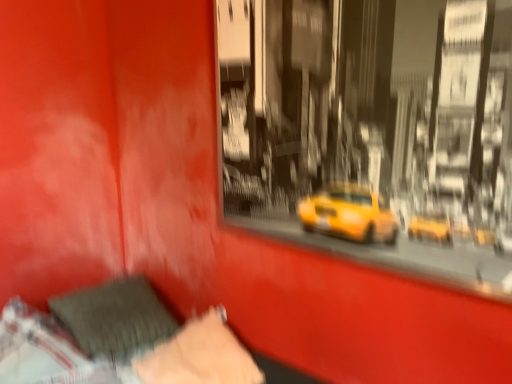
Question: Considering the positions of velvety black pillow at lower left, marked as the 2th pillow in a left-to-right arrangement, and velvety gray pillow at lower left, the second pillow in the right-to-left sequence, in the image, is velvety black pillow at lower left, marked as the 2th pillow in a left-to-right arrangement, bigger or smaller than velvety gray pillow at lower left, the second pillow in the right-to-left sequence,?

Choices:
 (A) small
 (B) big

Answer: (A)

Question: Is point (174, 347) positioned closer to the camera than point (173, 331)?

Choices:
 (A) farther
 (B) closer

Answer: (B)

Question: Which object is positioned farthest from the velvet-like gray pillow at lower left?

Choices:
 (A) velvety gray pillow at lower left, positioned as the first pillow in left-to-right order
 (B) velvety black pillow at lower left, positioned as the first pillow in right-to-left order

Answer: (B)

Question: Which object is positioned farthest from the velvet-like gray pillow at lower left?

Choices:
 (A) velvety black pillow at lower left, positioned as the first pillow in right-to-left order
 (B) velvety gray pillow at lower left, the second pillow in the right-to-left sequence

Answer: (A)